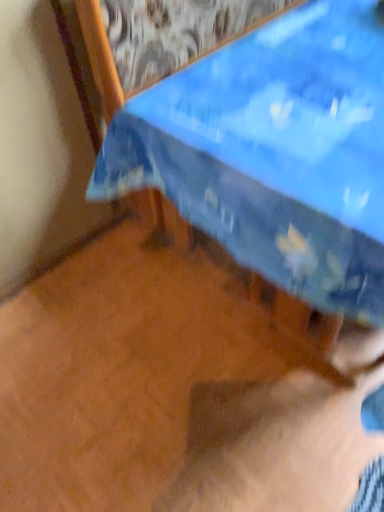
The width and height of the screenshot is (384, 512). I want to click on blue fabric table at upper right, so click(274, 152).

In order to face blue fabric table at upper right, should I rotate leftwards or rightwards?

It's best to rotate right around 24.170 degrees.

This screenshot has width=384, height=512. What do you see at coordinates (274, 152) in the screenshot?
I see `blue fabric table at upper right` at bounding box center [274, 152].

The image size is (384, 512). Find the location of `blue fabric table at upper right`. blue fabric table at upper right is located at coordinates (274, 152).